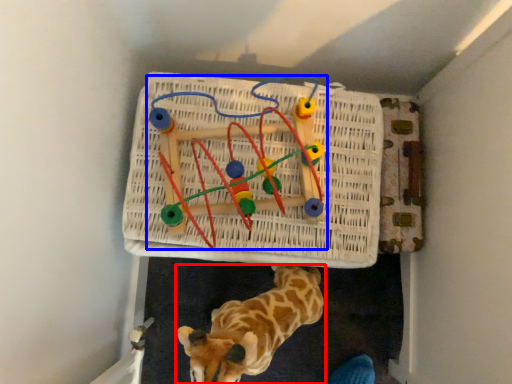
Question: Which point is further to the camera, giraffe (highlighted by a red box) or toy (highlighted by a blue box)?

Choices:
 (A) giraffe
 (B) toy

Answer: (B)